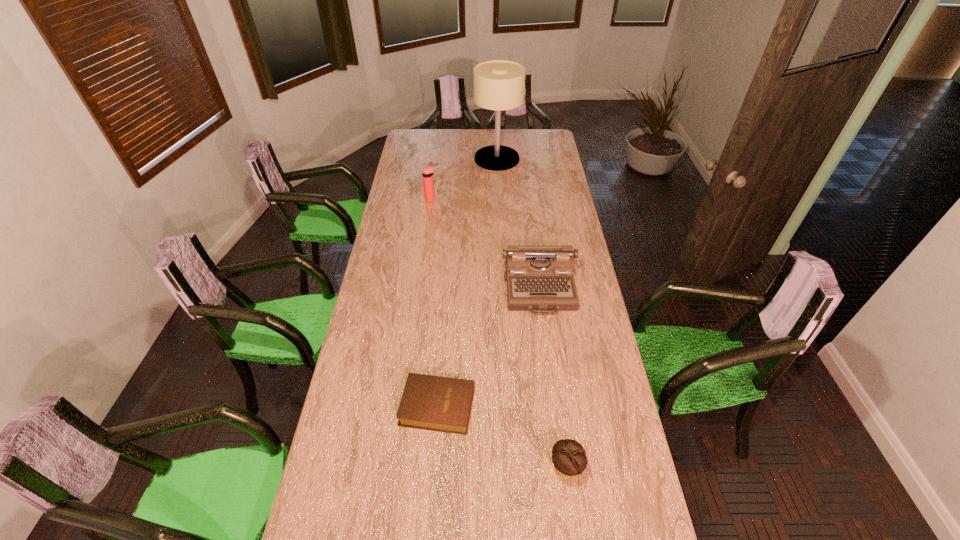
Locate an element on the screen. The image size is (960, 540). vacant region located on the left of the table lamp is located at coordinates (416, 159).

In order to click on free spot located 0.360m on the back of the second tallest object in this screenshot , I will do point(436,161).

You are a GUI agent. You are given a task and a screenshot of the screen. Output one action in this format:
    pyautogui.click(x=<x>, y=<y>)
    Task: Click on the free space located 0.120m on the keyboard of the typewriter
    Image resolution: width=960 pixels, height=540 pixels.
    Given the screenshot: What is the action you would take?
    pyautogui.click(x=546, y=341)

Where is `vacant position located 0.210m on the back of the muffin`? The height and width of the screenshot is (540, 960). vacant position located 0.210m on the back of the muffin is located at coordinates (556, 389).

This screenshot has height=540, width=960. Find the location of `free space located 0.320m on the back of the fourth farthest object`. free space located 0.320m on the back of the fourth farthest object is located at coordinates (444, 310).

You are a GUI agent. You are given a task and a screenshot of the screen. Output one action in this format:
    pyautogui.click(x=<x>, y=<y>)
    Task: Click on the object that is at the far edge
    
    Given the screenshot: What is the action you would take?
    pyautogui.click(x=499, y=85)

This screenshot has width=960, height=540. What are the coordinates of `typewriter located at the right edge` in the screenshot? It's located at (539, 278).

Where is `muffin that is at the right edge`? This screenshot has height=540, width=960. muffin that is at the right edge is located at coordinates (569, 457).

In the image, there is a desktop. Where is `vacant space at the far edge`? This screenshot has width=960, height=540. vacant space at the far edge is located at coordinates 461,143.

Where is `free space at the left edge of the desktop`? This screenshot has width=960, height=540. free space at the left edge of the desktop is located at coordinates (397, 344).